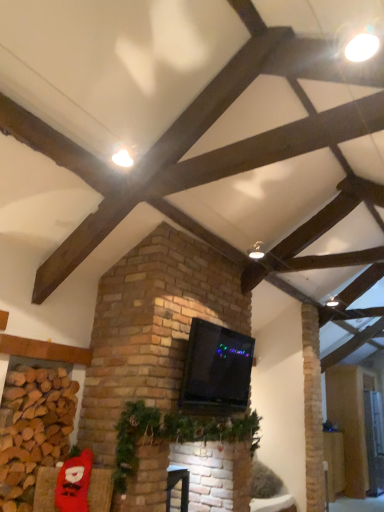
Question: Considering the positions of black glossy tv at center and matte white ceiling light at upper center in the image, is black glossy tv at center taller or shorter than matte white ceiling light at upper center?

Choices:
 (A) tall
 (B) short

Answer: (A)

Question: From a real-world perspective, is black glossy tv at center physically located above or below matte white ceiling light at upper center?

Choices:
 (A) above
 (B) below

Answer: (B)

Question: Estimate the real-world distances between objects in this image. Which object is closer to the red plush santa at lower left?

Choices:
 (A) wooden floorboard at lower right
 (B) brown brick at lower left
 (C) black glossy tv at center
 (D) green garland at center
 (E) matte white ceiling light at upper center

Answer: (B)

Question: Which object is the farthest from the black glossy tv at center?

Choices:
 (A) brown brick at lower left
 (B) matte white ceiling light at upper center
 (C) red plush santa at lower left
 (D) wooden floorboard at lower right
 (E) green garland at center

Answer: (D)